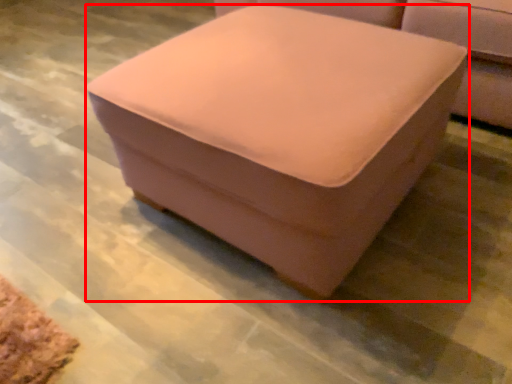
Question: From the image's perspective, what is the correct spatial positioning of furniture (annotated by the red box) in reference to studio couch?

Choices:
 (A) above
 (B) below

Answer: (B)